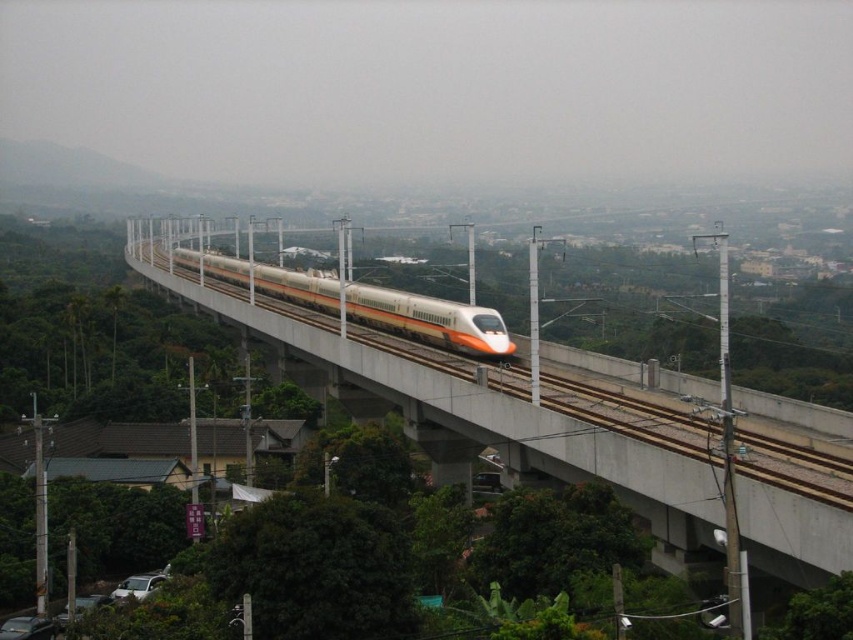
You are a photographer standing on a platform and want to capture the white glossy passenger train at center as it passes by. The yellow metallic train track at center is in your line of sight. Will the train be visible behind the track in your photo?

The yellow metallic train track at center is closer to the viewer than the white glossy passenger train at center, so the train will be partially obscured by the track in the photo.

You are a passenger on the white glossy passenger train at center and you want to look out the window to see the white concrete bridge at center. Which side of the train should you look towards?

The white concrete bridge at center is located to the left of the white glossy passenger train at center, so you should look towards the left side of the train to see it.